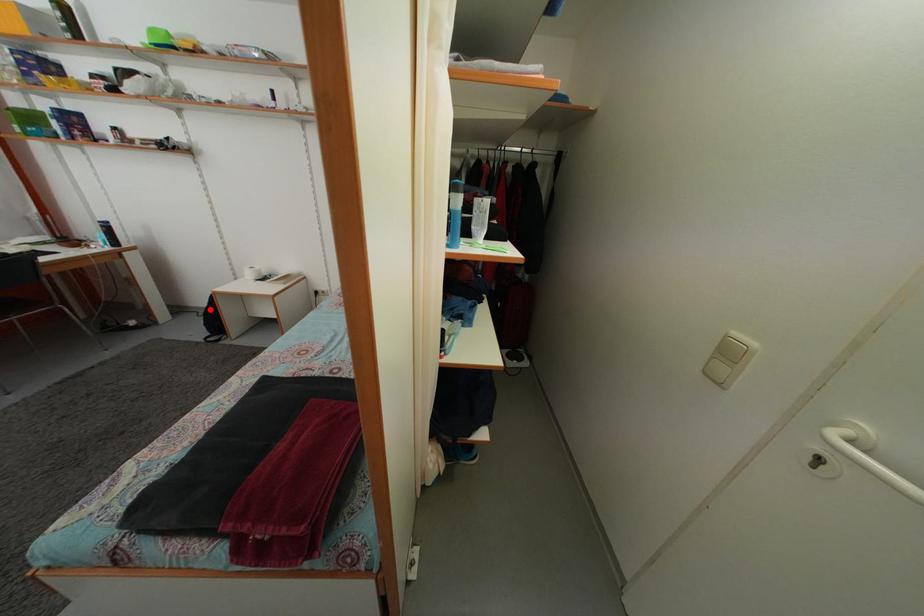
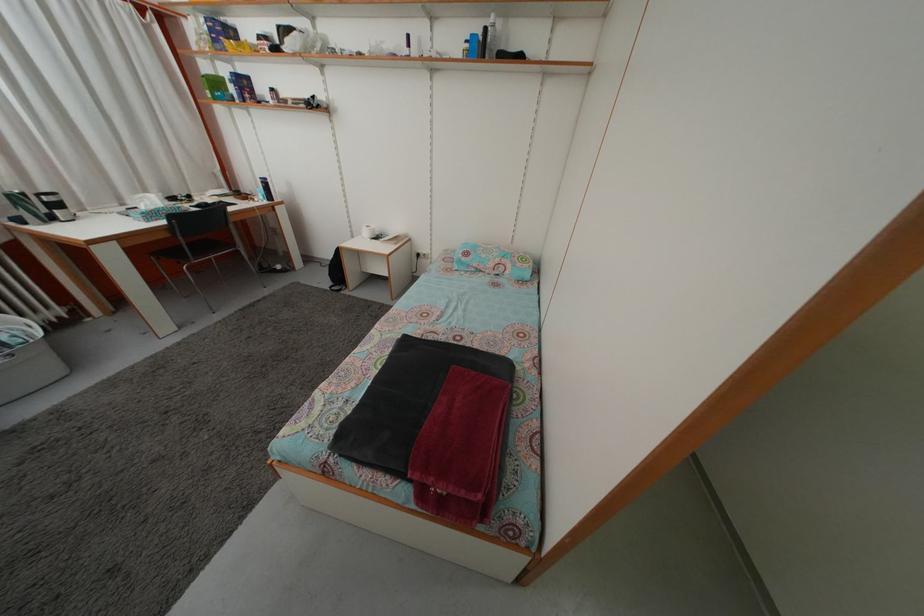
In the second image, find the point that corresponds to the highlighted location in the first image.

(335, 262)